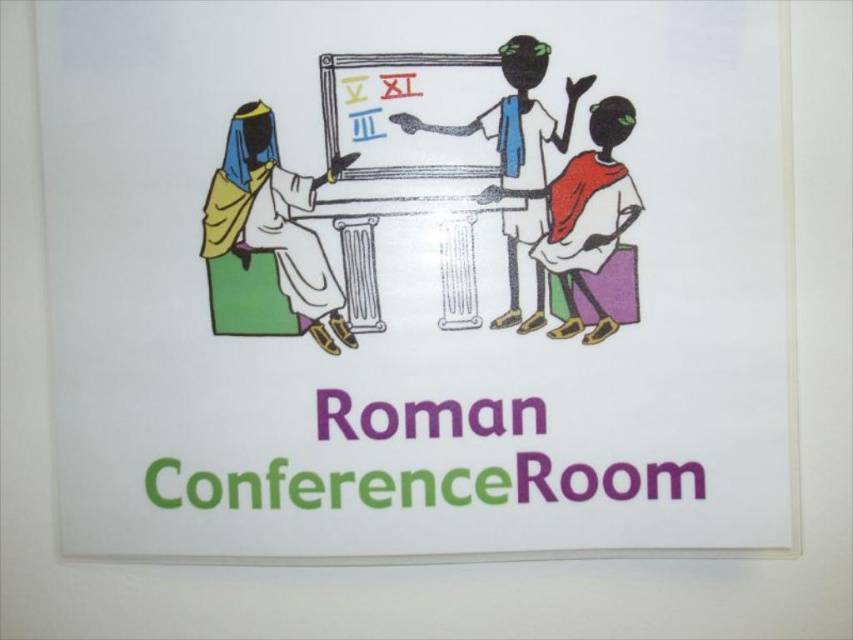
Does point (583, 193) lie behind point (408, 116)?

That is True.

Can you confirm if matte red dress at center is taller than matte whiteboard at center?

Incorrect, matte red dress at center's height is not larger of matte whiteboard at center's.

Where is `matte red dress at center`? The image size is (853, 640). matte red dress at center is located at coordinates (589, 216).

Is purple paper roman conference room at center to the right of whiteboard at center from the viewer's perspective?

Correct, you'll find purple paper roman conference room at center to the right of whiteboard at center.

Can you confirm if purple paper roman conference room at center is positioned above whiteboard at center?

Incorrect, purple paper roman conference room at center is not positioned above whiteboard at center.

Is point (265, 492) farther from viewer compared to point (476, 54)?

Yes, it is.

Where is `purple paper roman conference room at center`? This screenshot has width=853, height=640. purple paper roman conference room at center is located at coordinates (421, 484).

The height and width of the screenshot is (640, 853). Describe the element at coordinates (421, 484) in the screenshot. I see `purple paper roman conference room at center` at that location.

Is purple paper roman conference room at center wider than matte red dress at center?

Yes.

Does point (421, 481) come closer to viewer compared to point (613, 211)?

No, it is behind (613, 211).

This screenshot has width=853, height=640. Find the location of `purple paper roman conference room at center`. purple paper roman conference room at center is located at coordinates (421, 484).